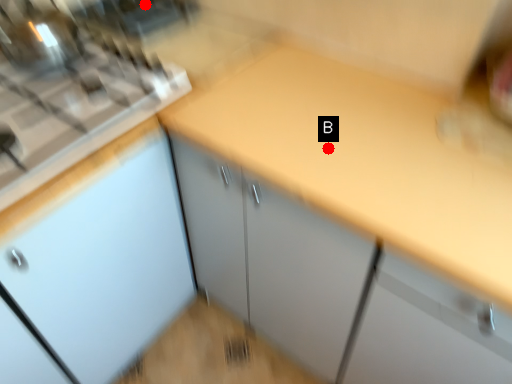
Question: Two points are circled on the image, labeled by A and B beside each circle. Among these points, which one is farthest from the camera?

Choices:
 (A) A is further
 (B) B is further

Answer: (A)